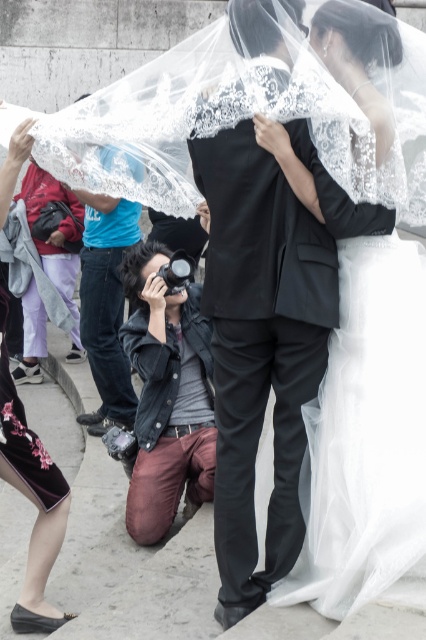
You are standing at the photographer position in the wedding scene. You want to place a flower decoration at the point that is closer to you. Which point should you choose between point (210, 492) and point (34, 589)?

Point (34, 589) is closer to you than point (210, 492), so you should choose point (34, 589) to place the flower decoration.

What is located at the coordinate point (31,499) in the image?

The velvet skirt at lower left is located at point (31,499).